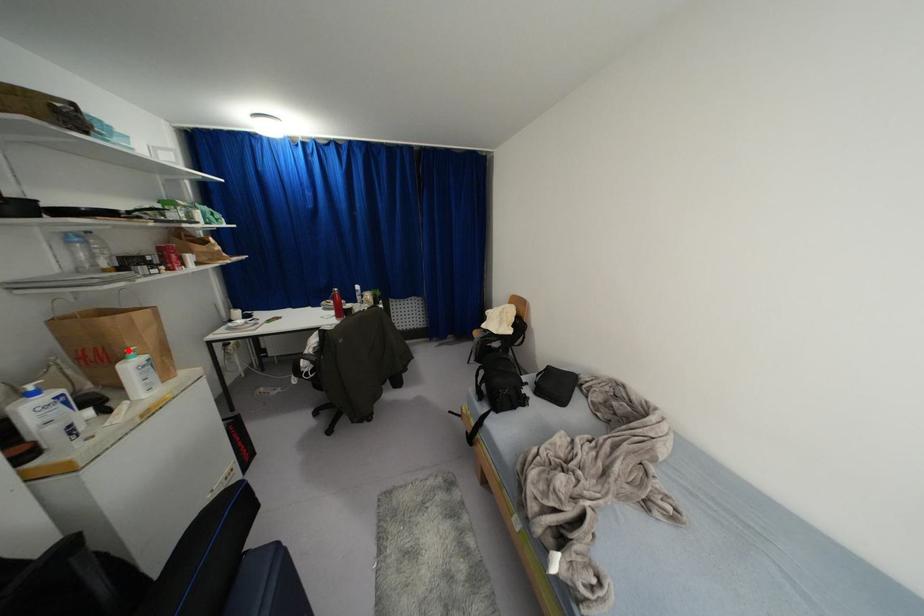
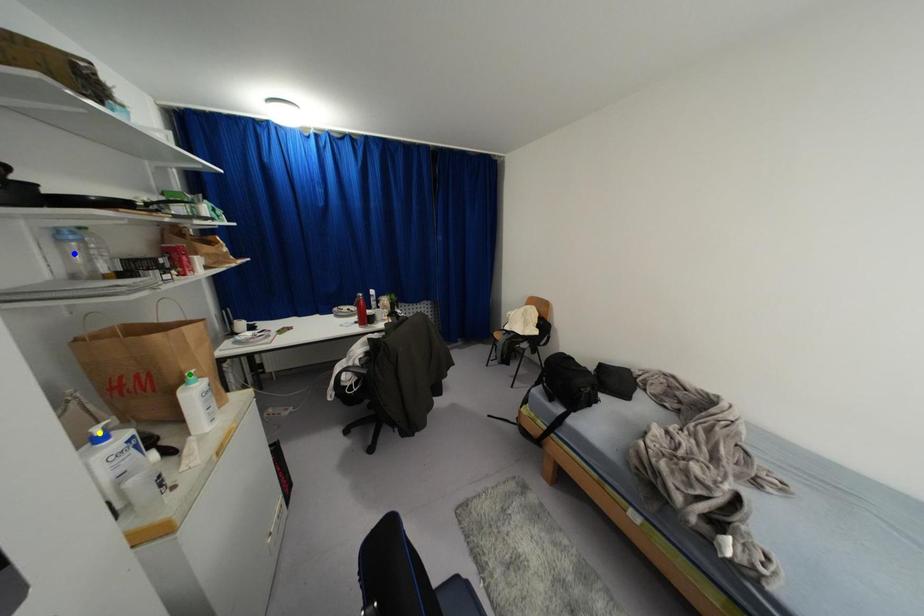
Question: I am providing you with two images of the same scene from different viewpoints. A red point is marked on the first image. You are given multiple points on the second image. Which mark in image 2 goes with the point in image 1?

Choices:
 (A) green point
 (B) blue point
 (C) yellow point

Answer: (A)